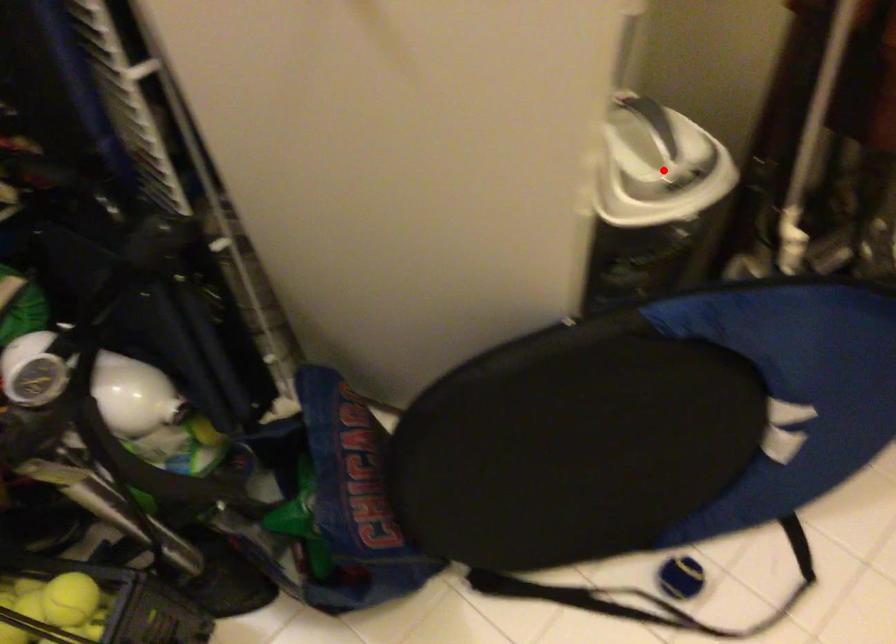
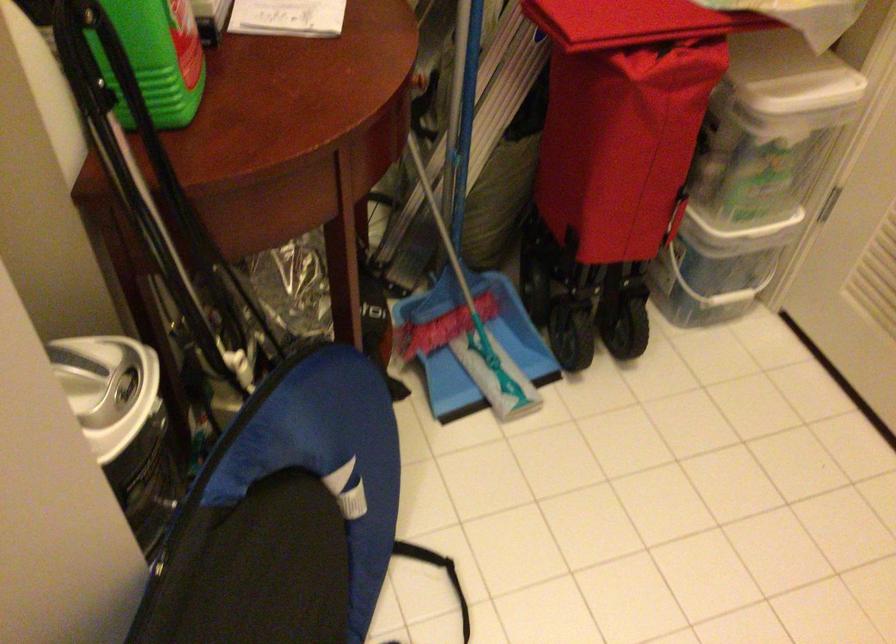
Find the pixel in the second image that matches the highlighted location in the first image.

(107, 388)